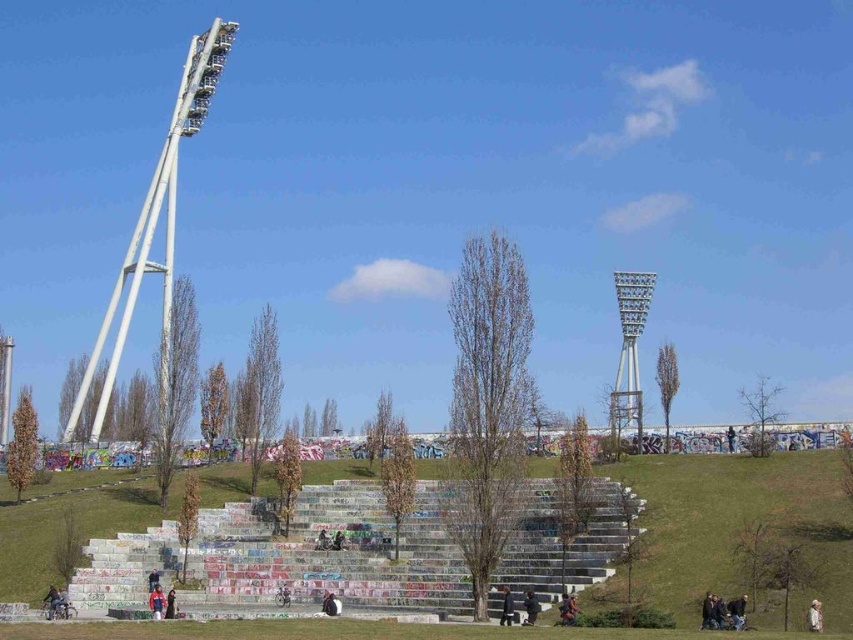
You are planning to install a new light pole in the park. You have two options based on the existing towers. The white metallic tower at left and the metallic gray tower at center. Which tower has a wider base to accommodate more lighting fixtures?

The white metallic tower at left has a larger width than the metallic gray tower at center, so it can accommodate more lighting fixtures due to its wider base.

You are a photographer setting up a shoot in the park. You have two items to place in the scene for the photo. The dark gray jacket at center and the white cotton shirt at lower right. According to the scene description, where should you place each item to match the existing objects in the image?

The dark gray jacket at center should be placed under the white cotton shirt at lower right as per their positions in the image.

You are standing at the bottom of the tiered stone steps and see both the red fabric jacket at lower left and the white cotton shirt at lower right. Which clothing item is closer to you?

The red fabric jacket at lower left is closer to you because the white cotton shirt at lower right is behind it.